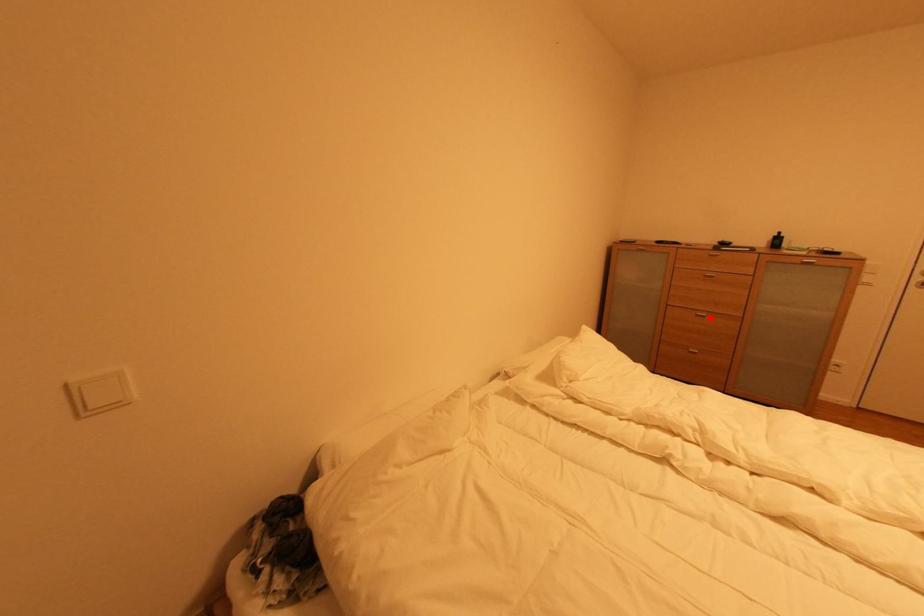
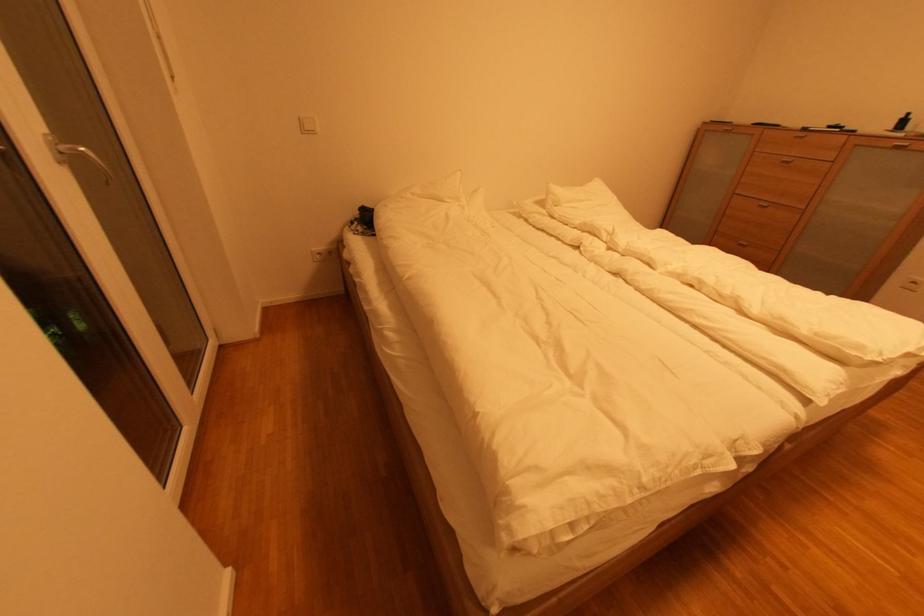
In the second image, find the point that corresponds to the highlighted location in the first image.

(772, 208)